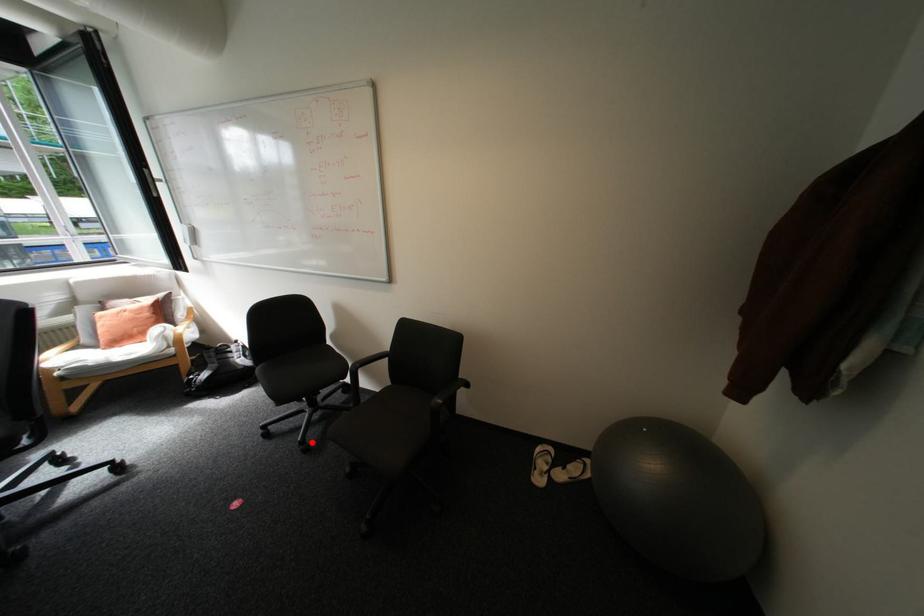
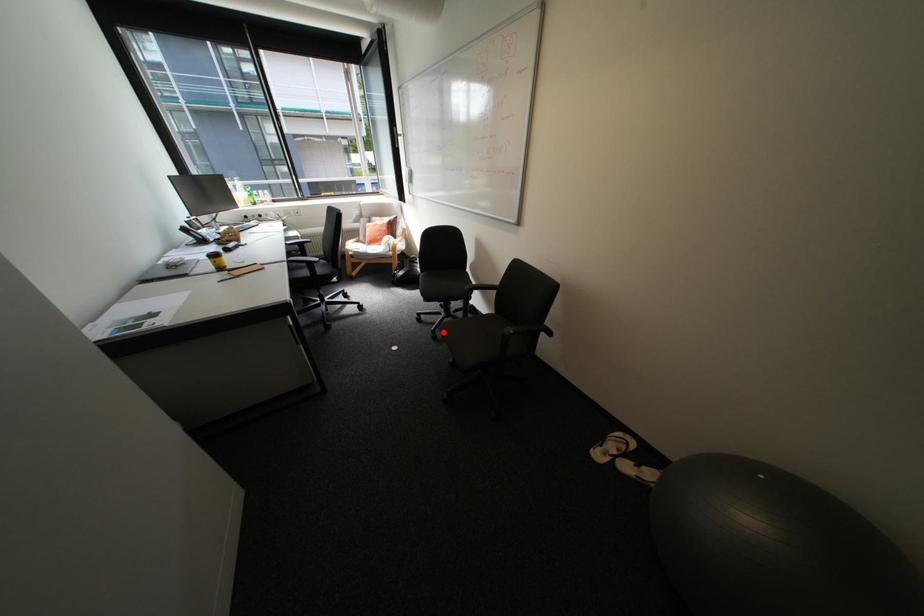
I am providing you with two images of the same scene from different viewpoints. A red point is marked on the first image and another point is marked on the second image. Does the point marked in image1 correspond to the same location as the one in image2?

Yes